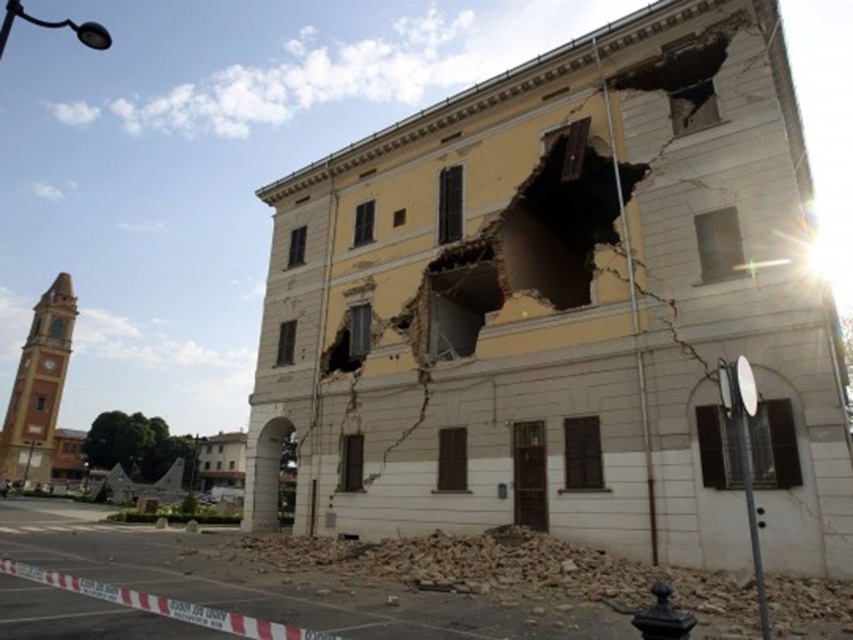
Does yellow plaster wall at center have a larger size compared to broken concrete rubble at lower center?

Yes.

Is yellow plaster wall at center positioned before broken concrete rubble at lower center?

No, yellow plaster wall at center is further to the viewer.

Is point (428, 385) positioned in front of point (792, 593)?

No, (428, 385) is further to viewer.

Where is `yellow plaster wall at center`? The image size is (853, 640). yellow plaster wall at center is located at coordinates (563, 307).